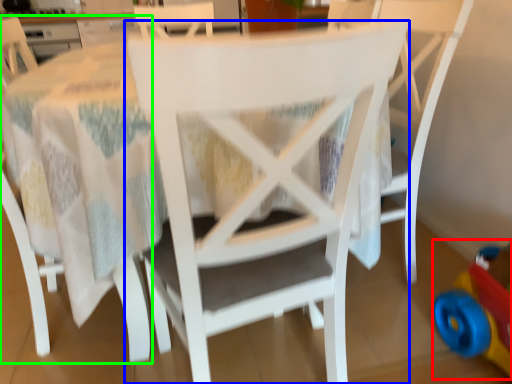
Question: Based on their relative distances, which object is nearer to toy (highlighted by a red box)? Choose from chair (highlighted by a blue box) and chair (highlighted by a green box).

Choices:
 (A) chair
 (B) chair

Answer: (A)